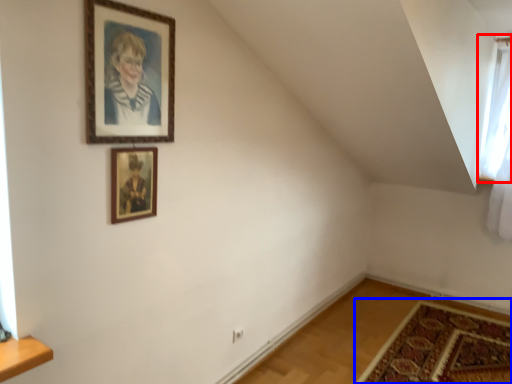
Question: Among these objects, which one is farthest to the camera, window (highlighted by a red box) or mat (highlighted by a blue box)?

Choices:
 (A) window
 (B) mat

Answer: (A)